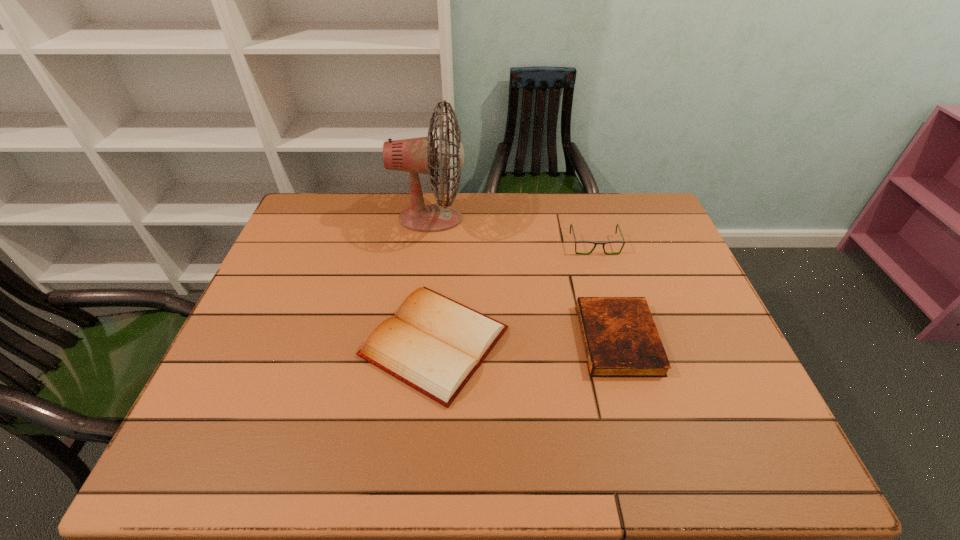
Locate an element on the screen. The width and height of the screenshot is (960, 540). blank area in the image that satisfies the following two spatial constraints: 1. in front of the left Bible to direct airflow; 2. on the right side of the fan is located at coordinates (415, 342).

The height and width of the screenshot is (540, 960). In order to click on free location that satisfies the following two spatial constraints: 1. in front of the left Bible to direct airflow; 2. on the right side of the fan in this screenshot , I will do `click(415, 342)`.

Locate an element on the screen. The image size is (960, 540). vacant space that satisfies the following two spatial constraints: 1. on the back side of the left Bible; 2. in front of the fan to direct airflow is located at coordinates (446, 219).

The width and height of the screenshot is (960, 540). Identify the location of free space that satisfies the following two spatial constraints: 1. on the lens of the third shortest object; 2. on the spine side of the right Bible. (622, 339).